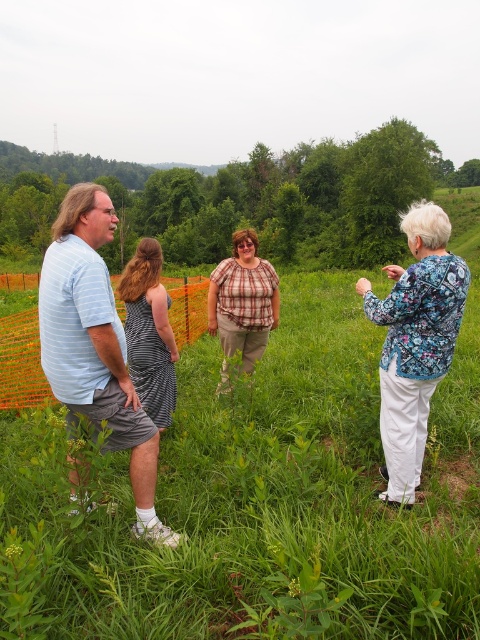
Who is more forward, (126, 310) or (24, 406)?

Point (126, 310) is in front.

Who is more distant from viewer, (168, 381) or (17, 339)?

Point (17, 339)

This screenshot has width=480, height=640. Describe the element at coordinates (148, 332) in the screenshot. I see `striped fabric dress at center` at that location.

Identify the location of striped fabric dress at center. The height and width of the screenshot is (640, 480). (148, 332).

Image resolution: width=480 pixels, height=640 pixels. What do you see at coordinates (257, 500) in the screenshot? I see `green grass at center` at bounding box center [257, 500].

Does green grass at center appear over striped fabric dress at center?

Yes, green grass at center is above striped fabric dress at center.

Which is in front, point (406, 588) or point (166, 320)?

Point (406, 588) is more forward.

This screenshot has height=640, width=480. I want to click on green grass at center, so click(x=257, y=500).

Is green grass at center above floral print blouse at right?

No.

Between point (418, 509) and point (418, 426), which one is positioned behind?

The point (418, 426) is more distant.

Where is `green grass at center`? This screenshot has height=640, width=480. green grass at center is located at coordinates (257, 500).